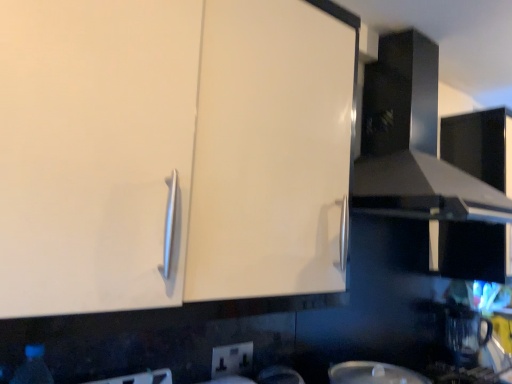
Question: Does transparent plastic bottle at lower left have a lesser height compared to transparent plastic coffee machine at lower right?

Choices:
 (A) no
 (B) yes

Answer: (A)

Question: From a real-world perspective, is transparent plastic bottle at lower left on top of transparent plastic coffee machine at lower right?

Choices:
 (A) no
 (B) yes

Answer: (B)

Question: From the image's perspective, would you say transparent plastic bottle at lower left is shown under transparent plastic coffee machine at lower right?

Choices:
 (A) yes
 (B) no

Answer: (B)

Question: Does transparent plastic bottle at lower left appear on the left side of transparent plastic coffee machine at lower right?

Choices:
 (A) yes
 (B) no

Answer: (A)

Question: Is transparent plastic coffee machine at lower right inside transparent plastic bottle at lower left?

Choices:
 (A) no
 (B) yes

Answer: (A)

Question: Does point (187, 79) appear closer or farther from the camera than point (20, 374)?

Choices:
 (A) farther
 (B) closer

Answer: (B)

Question: In terms of height, does white glossy cabinet at upper left look taller or shorter compared to transparent plastic bottle at lower left?

Choices:
 (A) tall
 (B) short

Answer: (A)

Question: Based on their sizes in the image, would you say white glossy cabinet at upper left is bigger or smaller than transparent plastic bottle at lower left?

Choices:
 (A) big
 (B) small

Answer: (A)

Question: In terms of width, does white glossy cabinet at upper left look wider or thinner when compared to transparent plastic bottle at lower left?

Choices:
 (A) thin
 (B) wide

Answer: (B)

Question: From a real-world perspective, is transparent plastic coffee machine at lower right physically located above or below glossy black exhaust hood at upper right?

Choices:
 (A) above
 (B) below

Answer: (B)

Question: From the image's perspective, is transparent plastic coffee machine at lower right above or below glossy black exhaust hood at upper right?

Choices:
 (A) above
 (B) below

Answer: (B)

Question: Is point (458, 322) closer or farther from the camera than point (411, 104)?

Choices:
 (A) closer
 (B) farther

Answer: (B)

Question: Would you say transparent plastic coffee machine at lower right is to the left or to the right of glossy black exhaust hood at upper right in the picture?

Choices:
 (A) right
 (B) left

Answer: (A)

Question: Looking at their shapes, would you say white plastic electric outlet at lower center is wider or thinner than transparent plastic bottle at lower left?

Choices:
 (A) wide
 (B) thin

Answer: (B)

Question: From the image's perspective, is white plastic electric outlet at lower center above or below transparent plastic bottle at lower left?

Choices:
 (A) below
 (B) above

Answer: (A)